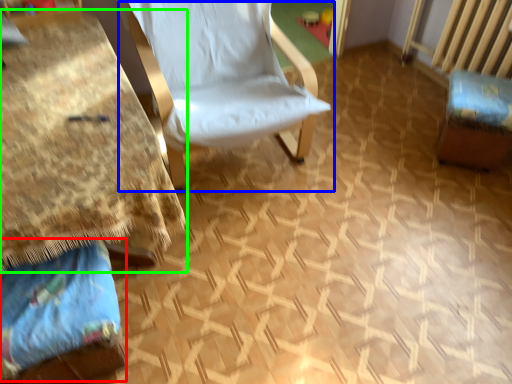
Question: Based on their relative distances, which object is nearer to fabric (highlighted by a red box)? Choose from chair (highlighted by a blue box) and table (highlighted by a green box).

Choices:
 (A) chair
 (B) table

Answer: (B)